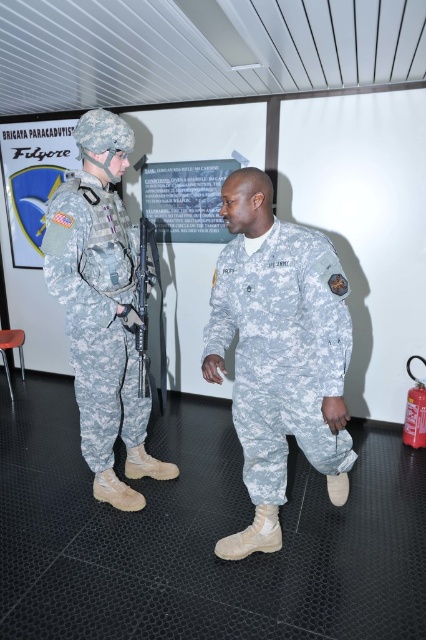
You are a military recruit observing two soldiers in the training facility. You notice the camouflage fabric uniform at center and the camouflage fabric uniform at left. Which one is shorter in height?

The camouflage fabric uniform at center is shorter in height compared to the camouflage fabric uniform at left.

Please look at the image and locate the point at coordinates (282, 349). What object is positioned at this point?

The camouflage fabric uniform at center is located at point (282, 349).

You are a tailor who needs to adjust the camouflage fabric uniforms for two soldiers. The camouflage fabric uniform at center and the camouflage fabric uniform at left must be altered to fit their respective wearers. Which uniform requires more fabric for adjustments?

The camouflage fabric uniform at center requires more fabric for adjustments because it is larger in size than the camouflage fabric uniform at left.